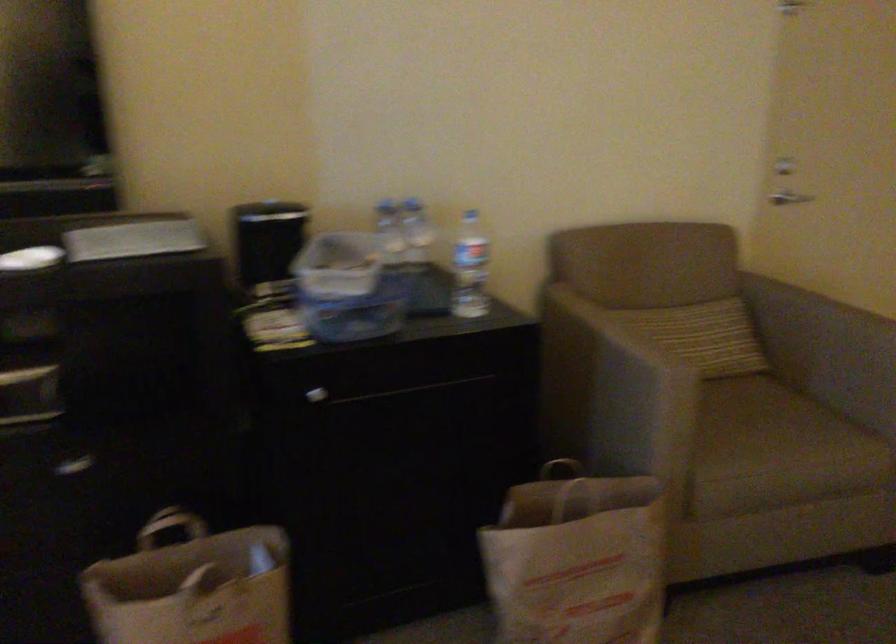
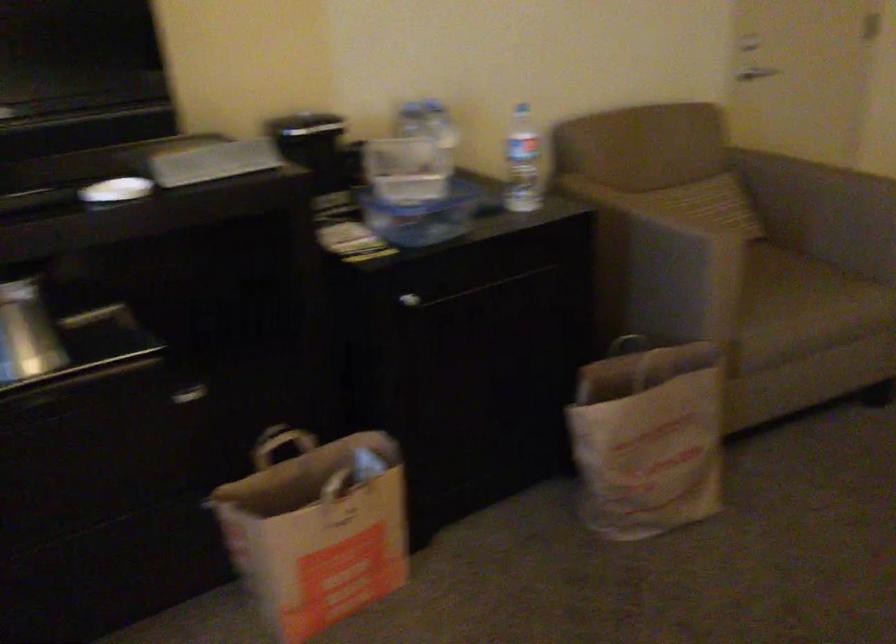
Question: In a continuous first-person perspective shot, in which direction is the camera moving?

Choices:
 (A) Left
 (B) Right
 (C) Forward
 (D) Backward

Answer: (A)